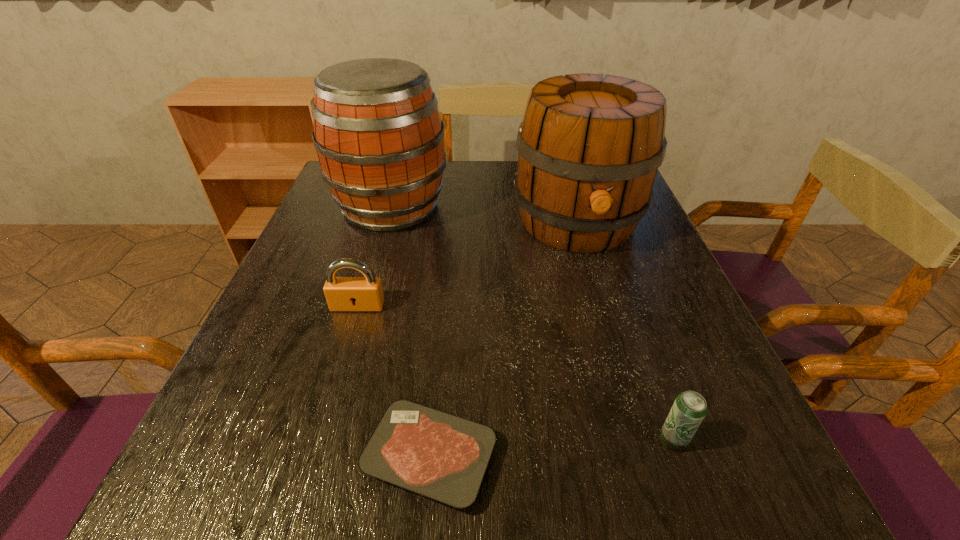
The width and height of the screenshot is (960, 540). In the image, there is a desktop. What are the coordinates of `free space at the left edge` in the screenshot? It's located at (252, 334).

Where is `blank space at the right edge of the desktop`? blank space at the right edge of the desktop is located at coordinates (720, 446).

This screenshot has width=960, height=540. Identify the location of vacant space at the near left corner of the desktop. (276, 471).

The width and height of the screenshot is (960, 540). What are the coordinates of `vacant space that is in between the shortest object and the third nearest object` in the screenshot? It's located at (394, 381).

The image size is (960, 540). In order to click on free space that is in between the right cider and the padlock in this screenshot , I will do `click(468, 265)`.

I want to click on vacant area between the left cider and the second shortest object, so click(x=532, y=323).

Where is `vacant area that lies between the third nearest object and the right cider`? The height and width of the screenshot is (540, 960). vacant area that lies between the third nearest object and the right cider is located at coordinates (468, 265).

Where is `empty space between the right cider and the left cider`? The width and height of the screenshot is (960, 540). empty space between the right cider and the left cider is located at coordinates (484, 215).

I want to click on vacant area that lies between the fourth tallest object and the shortest object, so click(551, 448).

Find the location of a particular element. vacant area that lies between the padlock and the beer can is located at coordinates (516, 373).